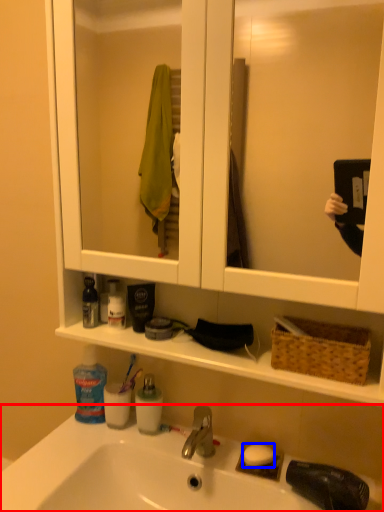
Question: Which point is closer to the camera, sink (highlighted by a red box) or soap (highlighted by a blue box)?

Choices:
 (A) sink
 (B) soap

Answer: (A)